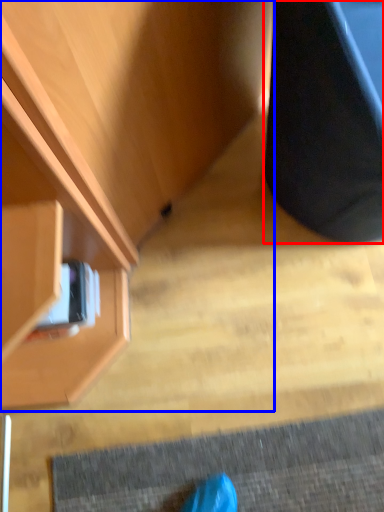
Question: Which of the following is the farthest to the observer, furniture (highlighted by a red box) or cabinetry (highlighted by a blue box)?

Choices:
 (A) furniture
 (B) cabinetry

Answer: (B)